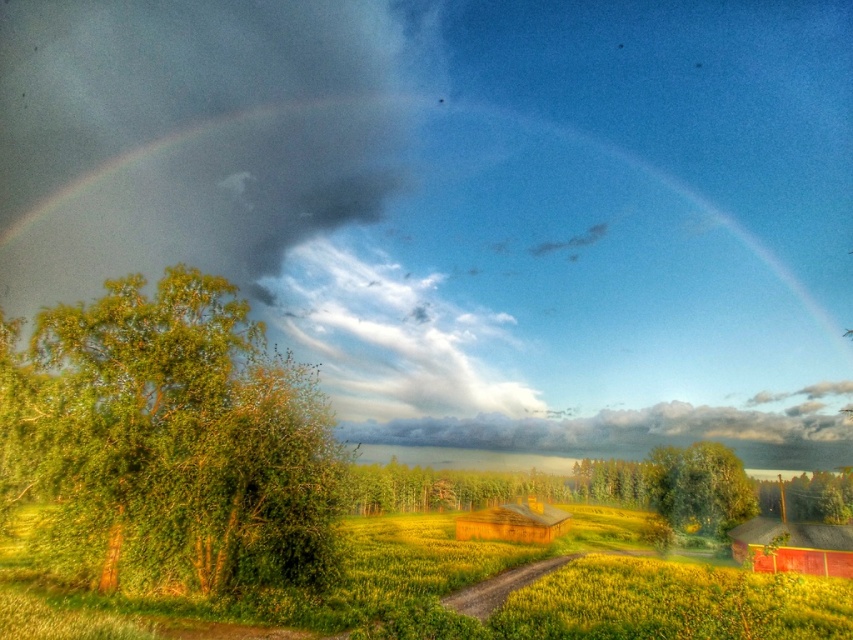
Which of these two, green leafy tree at center or wooden barn at center, stands taller?

Standing taller between the two is green leafy tree at center.

Does green leafy tree at center have a smaller size compared to wooden barn at center?

No, green leafy tree at center is not smaller than wooden barn at center.

Who is more distant from viewer, [721,465] or [558,513]?

The point [558,513] is behind.

Find the location of `green leafy tree at center`. green leafy tree at center is located at coordinates (700, 486).

Is green leafy tree at left bigger than wooden barn at lower right?

Indeed, green leafy tree at left has a larger size compared to wooden barn at lower right.

Who is shorter, green leafy tree at left or wooden barn at lower right?

With less height is wooden barn at lower right.

Is point (225, 368) behind point (805, 541)?

That is False.

This screenshot has width=853, height=640. Identify the location of green leafy tree at left. (178, 442).

Does wooden barn at lower right appear under green leafy tree at lower right?

No.

Image resolution: width=853 pixels, height=640 pixels. What do you see at coordinates (793, 547) in the screenshot?
I see `wooden barn at lower right` at bounding box center [793, 547].

The height and width of the screenshot is (640, 853). What do you see at coordinates (793, 547) in the screenshot?
I see `wooden barn at lower right` at bounding box center [793, 547].

Find the location of a particular element. This screenshot has height=640, width=853. wooden barn at lower right is located at coordinates (793, 547).